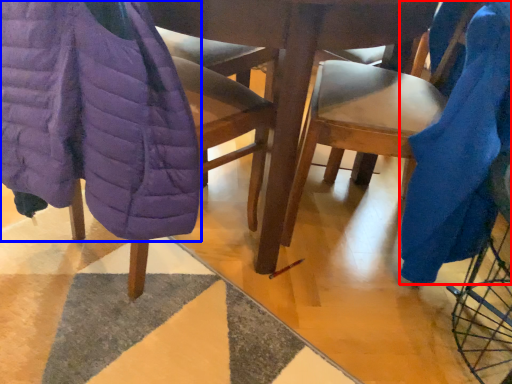
Question: Among these objects, which one is farthest to the camera, blanket (highlighted by a red box) or blanket (highlighted by a blue box)?

Choices:
 (A) blanket
 (B) blanket

Answer: (A)